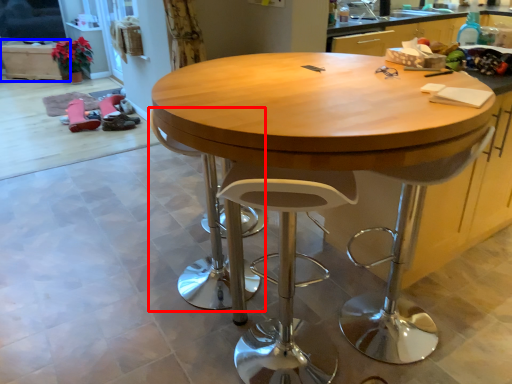
Question: Which object appears closest to the camera in this image, swivel chair (highlighted by a red box) or cabinetry (highlighted by a blue box)?

Choices:
 (A) swivel chair
 (B) cabinetry

Answer: (A)